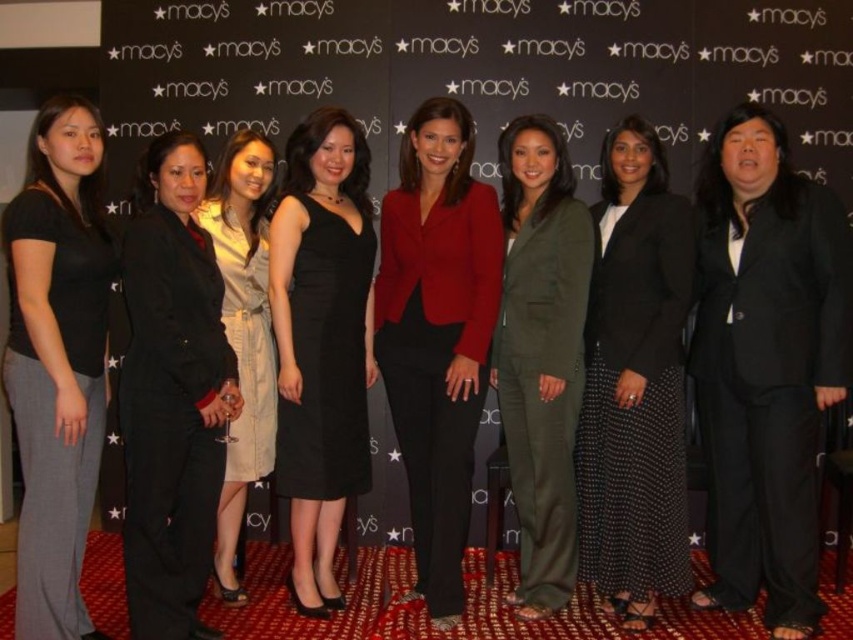
Question: Which object appears farthest from the camera in this image?

Choices:
 (A) black dotted skirt at center
 (B) black matte suit at left

Answer: (A)

Question: Does black matte suit at right lie in front of black dotted skirt at center?

Choices:
 (A) no
 (B) yes

Answer: (B)

Question: Is matte olive green suit at center positioned at the back of black satin dress at center?

Choices:
 (A) yes
 (B) no

Answer: (A)

Question: Is black matte suit at left bigger than light beige cotton dress at center?

Choices:
 (A) yes
 (B) no

Answer: (B)

Question: Which of the following is the farthest from the observer?

Choices:
 (A) (225, 385)
 (B) (358, 412)
 (C) (558, 486)

Answer: (B)

Question: Which of the following is the farthest from the observer?

Choices:
 (A) (x=218, y=474)
 (B) (x=547, y=570)
 (C) (x=637, y=508)

Answer: (B)